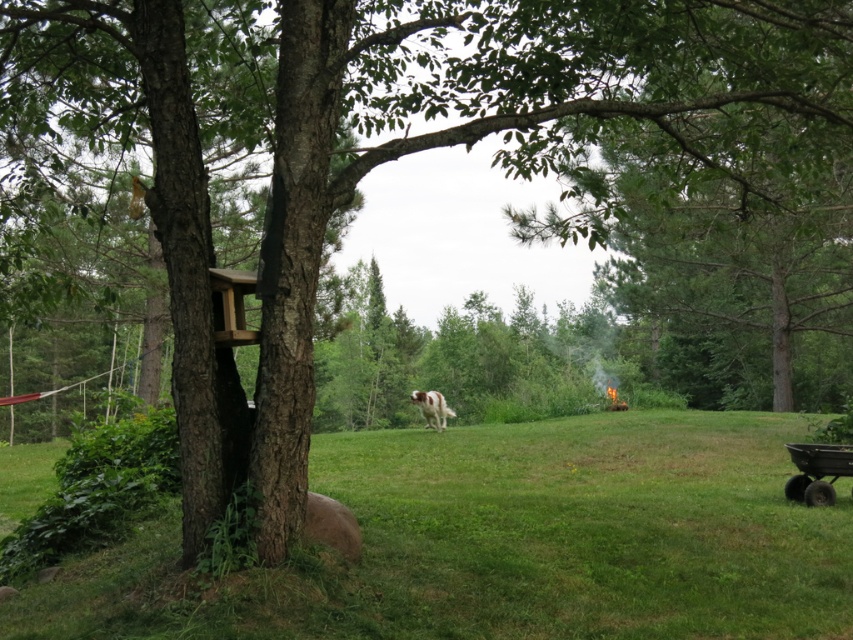
Based on the photo, you are standing at the point labeled as point (511, 541) in the image. Looking around, you see a dog with a white coat and reddish brown patches running on the green grass at center. Can you tell me what surface you are currently standing on?

The point (511, 541) is on green grass at center, so you are standing on the green grass at center.

You are standing at the origin point of the image coordinate system. The origin is at the bottom left corner of the image. You want to walk to the green grass at center. In which direction should you move relative to your current position?

The green grass at center is located at coordinate point (511, 541). Since the origin is at the bottom left corner, moving towards the right and slightly upwards would lead you to the green grass at center.

You are trying to decide where to place a small garden ornament. The ornament requires a space that is wider than the white fur with brown spots at center. Based on the scene, can the green grass at center accommodate this requirement?

The green grass at center might be wider than the white fur with brown spots at center, so it is possible that the green grass at center can accommodate the ornament if its width meets the requirement.